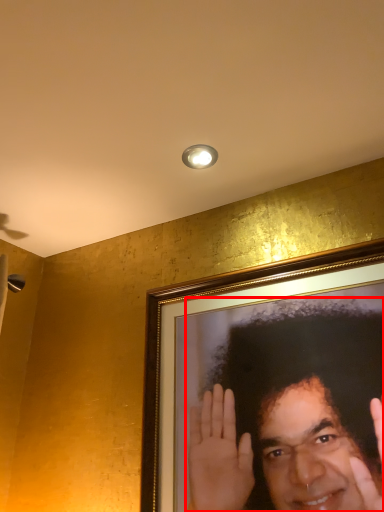
Question: From the image's perspective, where is man (annotated by the red box) located relative to light fixture?

Choices:
 (A) below
 (B) above

Answer: (A)